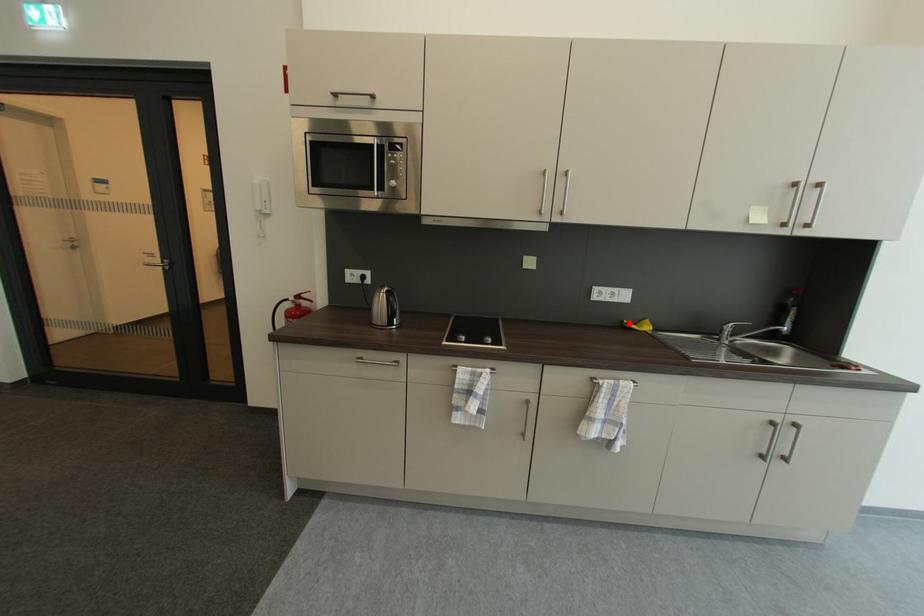
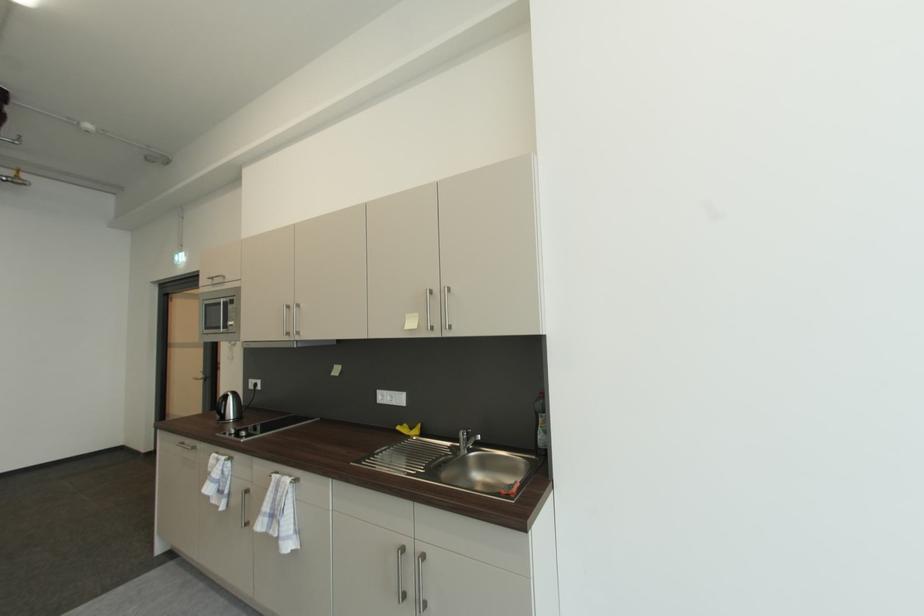
Question: A red point is marked in image1. In image2, is the corresponding 3D point closer to the camera or farther? Reply with the corresponding letter.

Choices:
 (A) The corresponding 3D point is closer.
 (B) The corresponding 3D point is farther.

Answer: (B)